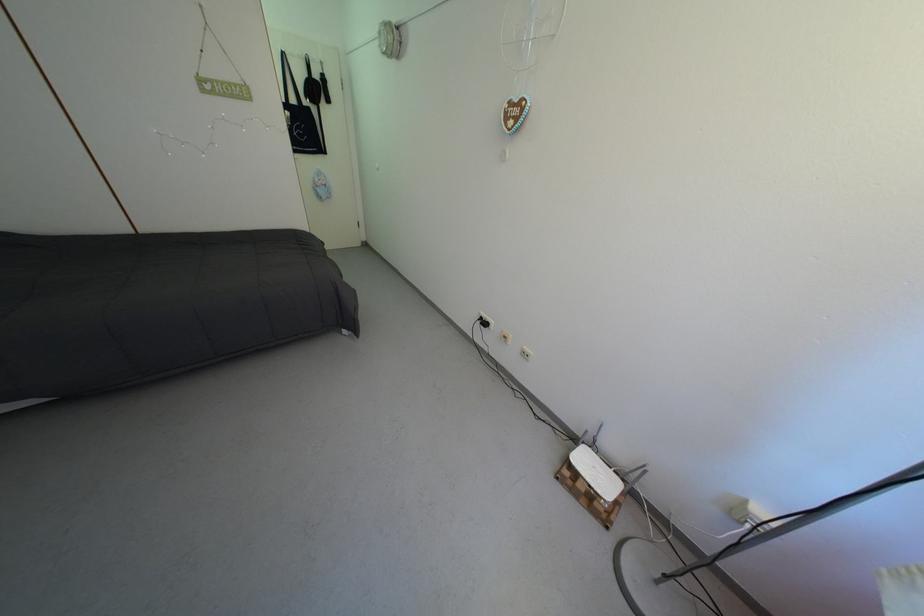
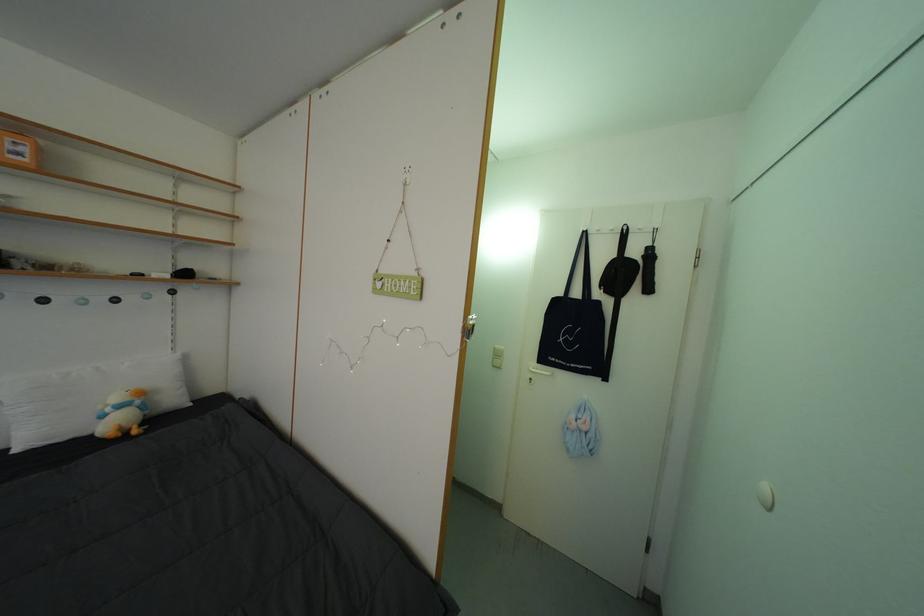
Find the pixel in the second image that matches the point at 309,81 in the first image.

(611, 264)